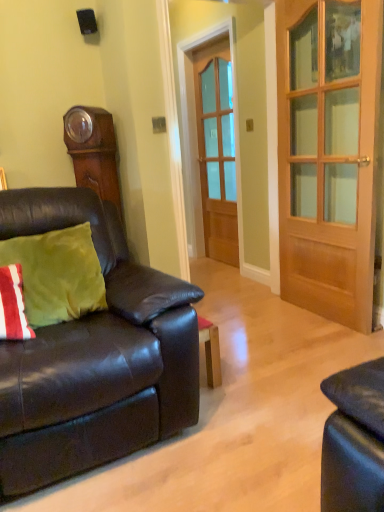
Locate an element on the screen. The height and width of the screenshot is (512, 384). vacant position to the left of wooden door at center, which is the first door from front to back is located at coordinates (268, 324).